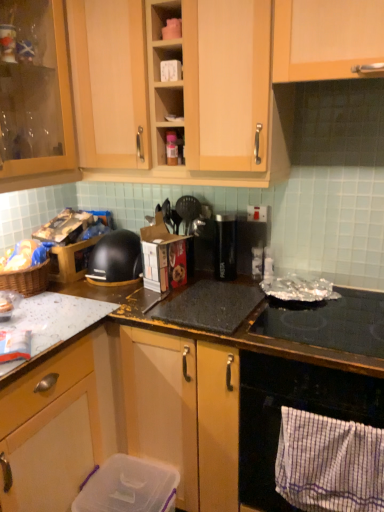
Question: From the image's perspective, is black plastic toaster at center, which appears as the 3th appliance when ordered from the bottom, located beneath clear plastic container at lower center, positioned as the first appliance in left-to-right order?

Choices:
 (A) yes
 (B) no

Answer: (B)

Question: Could you tell me if black plastic toaster at center, which appears as the 3th appliance when ordered from the bottom, is facing clear plastic container at lower center, the fourth appliance from the top?

Choices:
 (A) no
 (B) yes

Answer: (A)

Question: Is black plastic toaster at center, acting as the 2th appliance starting from the top, closer to camera compared to clear plastic container at lower center, the fourth appliance viewed from the right?

Choices:
 (A) yes
 (B) no

Answer: (B)

Question: Does black plastic toaster at center, the 3th appliance in the left-to-right sequence, have a greater width compared to clear plastic container at lower center, the fourth appliance viewed from the right?

Choices:
 (A) no
 (B) yes

Answer: (A)

Question: Is black plastic toaster at center, marked as the 2th appliance in a right-to-left arrangement, positioned behind clear plastic container at lower center, the fourth appliance viewed from the right?

Choices:
 (A) no
 (B) yes

Answer: (B)

Question: From the image's perspective, is black plastic toaster at center, acting as the 2th appliance starting from the top, on top of clear plastic container at lower center, the fourth appliance from the top?

Choices:
 (A) yes
 (B) no

Answer: (A)

Question: Is white striped towel at lower right with black plastic toaster at center, the 3th appliance in the left-to-right sequence?

Choices:
 (A) yes
 (B) no

Answer: (B)

Question: From a real-world perspective, is white striped towel at lower right beneath black plastic toaster at center, the 3th appliance in the left-to-right sequence?

Choices:
 (A) no
 (B) yes

Answer: (B)

Question: Can black plastic toaster at center, the 3th appliance in the left-to-right sequence, be found inside white striped towel at lower right?

Choices:
 (A) yes
 (B) no

Answer: (B)

Question: From the image's perspective, does white striped towel at lower right appear lower than black plastic toaster at center, the 3th appliance in the left-to-right sequence?

Choices:
 (A) yes
 (B) no

Answer: (A)

Question: Can you confirm if white striped towel at lower right is positioned to the left of black plastic toaster at center, marked as the 2th appliance in a right-to-left arrangement?

Choices:
 (A) no
 (B) yes

Answer: (A)

Question: Considering the relative sizes of white striped towel at lower right and black plastic toaster at center, the 3th appliance in the left-to-right sequence, in the image provided, is white striped towel at lower right taller than black plastic toaster at center, the 3th appliance in the left-to-right sequence,?

Choices:
 (A) yes
 (B) no

Answer: (A)

Question: Is black glass oven at lower right outside of metallic silver cooking utensils at center, positioned as the 2th appliance in left-to-right order?

Choices:
 (A) no
 (B) yes

Answer: (B)